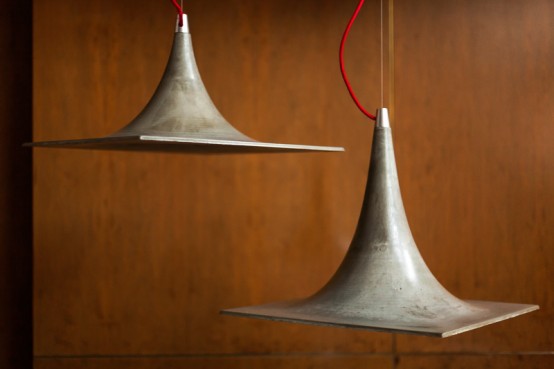
Identify the location of top left part of the wall. (218, 199).